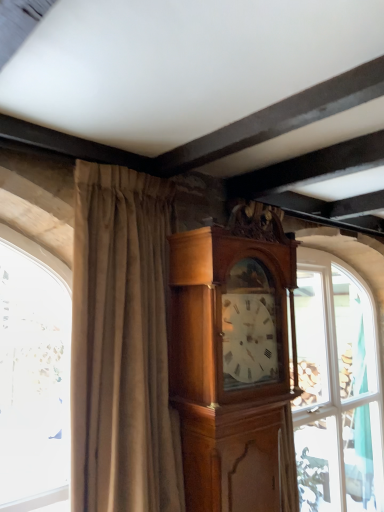
Question: Is beige velvet curtain at center further to the viewer compared to clear glass window at center?

Choices:
 (A) yes
 (B) no

Answer: (B)

Question: From the image's perspective, does beige velvet curtain at center appear lower than clear glass window at center?

Choices:
 (A) yes
 (B) no

Answer: (B)

Question: Is beige velvet curtain at center with clear glass window at center?

Choices:
 (A) yes
 (B) no

Answer: (B)

Question: Is beige velvet curtain at center to the right of clear glass window at center from the viewer's perspective?

Choices:
 (A) yes
 (B) no

Answer: (B)

Question: Is beige velvet curtain at center far away from clear glass window at center?

Choices:
 (A) yes
 (B) no

Answer: (A)

Question: From a real-world perspective, is beige velvet curtain at center located beneath clear glass window at center?

Choices:
 (A) yes
 (B) no

Answer: (B)

Question: From the image's perspective, would you say polished wood grandfather clock at center is positioned over clear glass window at center?

Choices:
 (A) yes
 (B) no

Answer: (A)

Question: Could clear glass window at center be considered to be inside polished wood grandfather clock at center?

Choices:
 (A) no
 (B) yes

Answer: (A)

Question: From the image's perspective, is polished wood grandfather clock at center beneath clear glass window at center?

Choices:
 (A) no
 (B) yes

Answer: (A)

Question: Does polished wood grandfather clock at center have a lesser width compared to clear glass window at center?

Choices:
 (A) yes
 (B) no

Answer: (A)

Question: From a real-world perspective, is polished wood grandfather clock at center on clear glass window at center?

Choices:
 (A) no
 (B) yes

Answer: (B)

Question: Considering the relative sizes of polished wood grandfather clock at center and clear glass window at center in the image provided, is polished wood grandfather clock at center wider than clear glass window at center?

Choices:
 (A) yes
 (B) no

Answer: (B)

Question: Considering the relative positions of clear glass window at center and beige velvet curtain at center in the image provided, is clear glass window at center to the right of beige velvet curtain at center from the viewer's perspective?

Choices:
 (A) yes
 (B) no

Answer: (A)